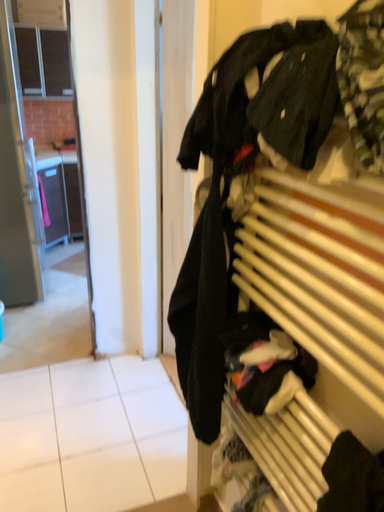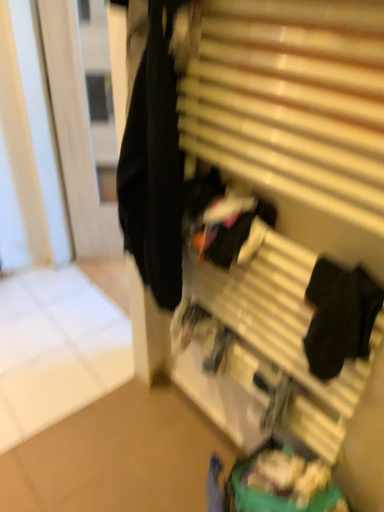
Question: How did the camera likely rotate when shooting the video?

Choices:
 (A) rotated downward
 (B) rotated upward

Answer: (A)